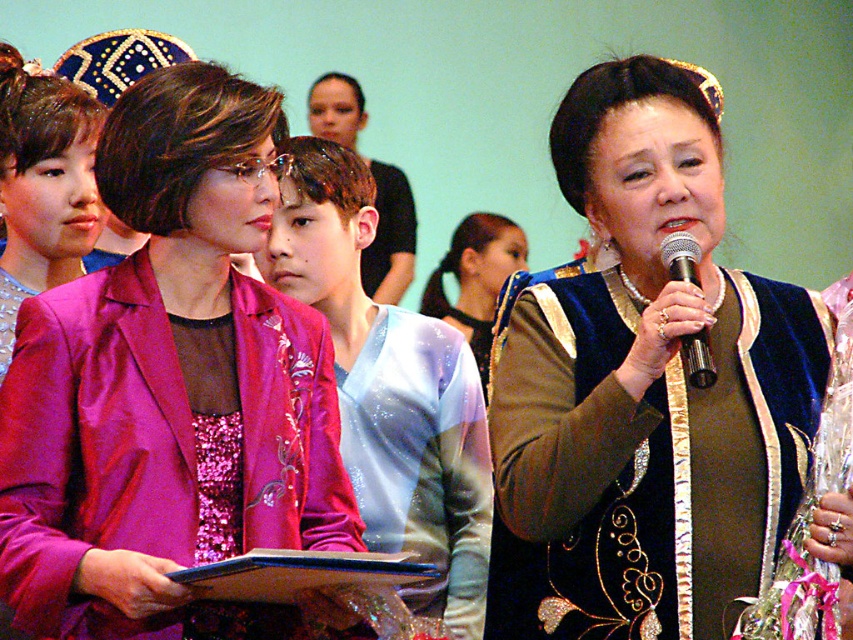
You are at a formal event and need to locate the velvet brown dress at center and the metallic silver microphone at upper center. According to the spatial arrangement, which object is positioned to the left of the other?

The velvet brown dress at center is to the left of the metallic silver microphone at upper center.